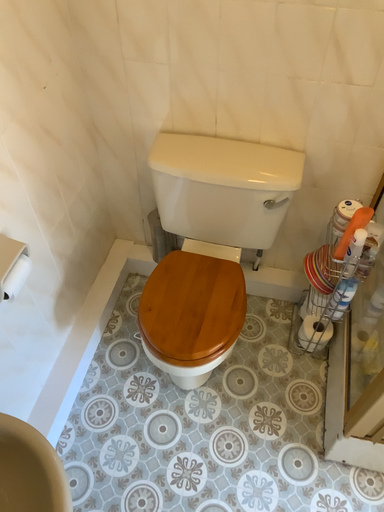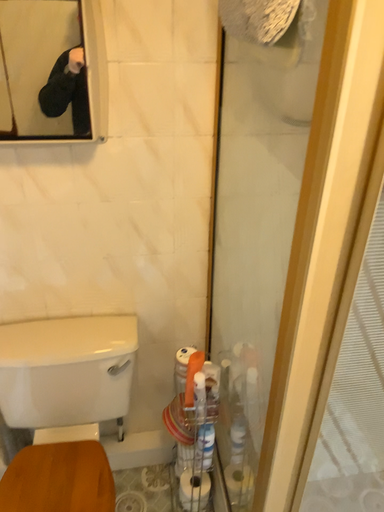
Question: Which way did the camera rotate in the video?

Choices:
 (A) rotated right
 (B) rotated left

Answer: (A)